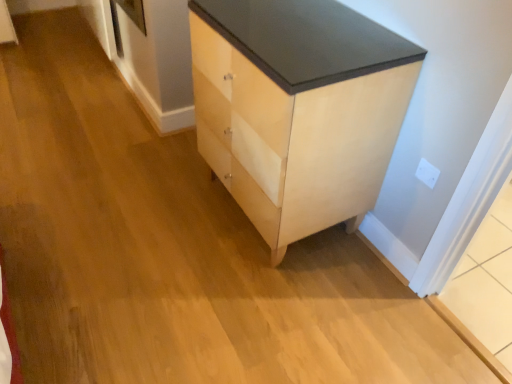
In order to face light wood/veneer chest of drawers at center, should I rotate leftwards or rightwards?

You should rotate right by 3.805 degrees.

The height and width of the screenshot is (384, 512). Identify the location of light wood/veneer chest of drawers at center. (298, 109).

The height and width of the screenshot is (384, 512). Describe the element at coordinates (298, 109) in the screenshot. I see `light wood/veneer chest of drawers at center` at that location.

What is the approximate width of light wood/veneer chest of drawers at center?

It is 20.79 inches.

What is the approximate height of light wood/veneer chest of drawers at center?

light wood/veneer chest of drawers at center is 86.22 centimeters tall.

In order to face white plastic electric outlet at upper right, should I rotate leftwards or rightwards?

It's best to rotate right around 21.569 degrees.

Describe the element at coordinates (426, 173) in the screenshot. I see `white plastic electric outlet at upper right` at that location.

You are a GUI agent. You are given a task and a screenshot of the screen. Output one action in this format:
    pyautogui.click(x=<x>, y=<y>)
    Task: Click on the white plastic electric outlet at upper right
    
    Given the screenshot: What is the action you would take?
    pyautogui.click(x=426, y=173)

Find the location of a particular element. The image size is (512, 384). light wood/veneer chest of drawers at center is located at coordinates tap(298, 109).

Can you confirm if white plastic electric outlet at upper right is positioned to the right of light wood/veneer chest of drawers at center?

Yes, white plastic electric outlet at upper right is to the right of light wood/veneer chest of drawers at center.

Is white plastic electric outlet at upper right positioned before light wood/veneer chest of drawers at center?

No, the depth of white plastic electric outlet at upper right is greater than that of light wood/veneer chest of drawers at center.

Which is less distant, [430,179] or [259,143]?

Positioned in front is point [259,143].

Looking at this image, from the image's perspective, is white plastic electric outlet at upper right positioned above or below light wood/veneer chest of drawers at center?

From the image's perspective, white plastic electric outlet at upper right appears below light wood/veneer chest of drawers at center.

From a real-world perspective, which is physically above, white plastic electric outlet at upper right or light wood/veneer chest of drawers at center?

white plastic electric outlet at upper right, from a real-world perspective.

Considering the sizes of objects white plastic electric outlet at upper right and light wood/veneer chest of drawers at center in the image provided, who is wider, white plastic electric outlet at upper right or light wood/veneer chest of drawers at center?

Wider between the two is light wood/veneer chest of drawers at center.

Between white plastic electric outlet at upper right and light wood/veneer chest of drawers at center, which one has more height?

Standing taller between the two is light wood/veneer chest of drawers at center.

Based on their sizes in the image, would you say white plastic electric outlet at upper right is bigger or smaller than light wood/veneer chest of drawers at center?

white plastic electric outlet at upper right is smaller than light wood/veneer chest of drawers at center.

Is white plastic electric outlet at upper right completely or partially outside of light wood/veneer chest of drawers at center?

That's correct, white plastic electric outlet at upper right is outside of light wood/veneer chest of drawers at center.

Is white plastic electric outlet at upper right next to light wood/veneer chest of drawers at center?

No, white plastic electric outlet at upper right is not making contact with light wood/veneer chest of drawers at center.

Is white plastic electric outlet at upper right aimed at light wood/veneer chest of drawers at center?

No, white plastic electric outlet at upper right is not facing towards light wood/veneer chest of drawers at center.

What's the angular difference between white plastic electric outlet at upper right and light wood/veneer chest of drawers at center's facing directions?

The angular difference between white plastic electric outlet at upper right and light wood/veneer chest of drawers at center is 0.0642 degrees.

Identify the location of the chest of drawers below the white plastic electric outlet at upper right (from a real-world perspective). Image resolution: width=512 pixels, height=384 pixels. (298, 109).

Which is more to the right, light wood/veneer chest of drawers at center or white plastic electric outlet at upper right?

white plastic electric outlet at upper right.

Considering the positions of objects light wood/veneer chest of drawers at center and white plastic electric outlet at upper right in the image provided, who is in front, light wood/veneer chest of drawers at center or white plastic electric outlet at upper right?

light wood/veneer chest of drawers at center is more forward.

Does point (270, 84) lie behind point (422, 164)?

No, (270, 84) is in front of (422, 164).

From the image's perspective, which one is positioned lower, light wood/veneer chest of drawers at center or white plastic electric outlet at upper right?

white plastic electric outlet at upper right is shown below in the image.

From a real-world perspective, who is located lower, light wood/veneer chest of drawers at center or white plastic electric outlet at upper right?

light wood/veneer chest of drawers at center, from a real-world perspective.

Considering the sizes of light wood/veneer chest of drawers at center and white plastic electric outlet at upper right in the image, is light wood/veneer chest of drawers at center wider or thinner than white plastic electric outlet at upper right?

In the image, light wood/veneer chest of drawers at center appears to be wider than white plastic electric outlet at upper right.

Can you confirm if light wood/veneer chest of drawers at center is taller than white plastic electric outlet at upper right?

Correct, light wood/veneer chest of drawers at center is much taller as white plastic electric outlet at upper right.

Consider the image. Between light wood/veneer chest of drawers at center and white plastic electric outlet at upper right, which one has smaller size?

white plastic electric outlet at upper right.

Would you say light wood/veneer chest of drawers at center contains white plastic electric outlet at upper right?

No.

Is light wood/veneer chest of drawers at center positioned far away from white plastic electric outlet at upper right?

No, light wood/veneer chest of drawers at center is not far from white plastic electric outlet at upper right.

Is light wood/veneer chest of drawers at center looking in the opposite direction of white plastic electric outlet at upper right?

That's not correct — light wood/veneer chest of drawers at center is not looking away from white plastic electric outlet at upper right.

Identify the location of chest of drawers on the left side of white plastic electric outlet at upper right. (298, 109).

Locate an element on the screen. The width and height of the screenshot is (512, 384). the chest of drawers located above the white plastic electric outlet at upper right (from the image's perspective) is located at coordinates (298, 109).

Find the location of a particular element. The height and width of the screenshot is (384, 512). electric outlet that is behind the light wood/veneer chest of drawers at center is located at coordinates (426, 173).